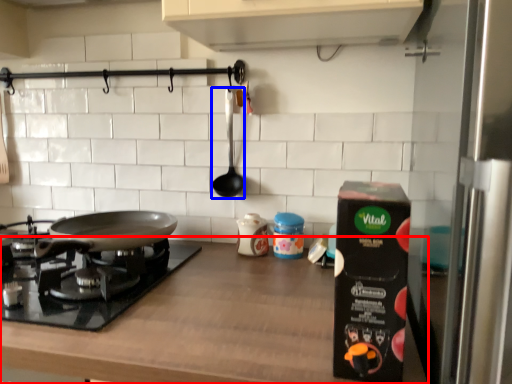
Question: Which object is closer to the camera taking this photo, countertop (highlighted by a red box) or utensil (highlighted by a blue box)?

Choices:
 (A) countertop
 (B) utensil

Answer: (A)